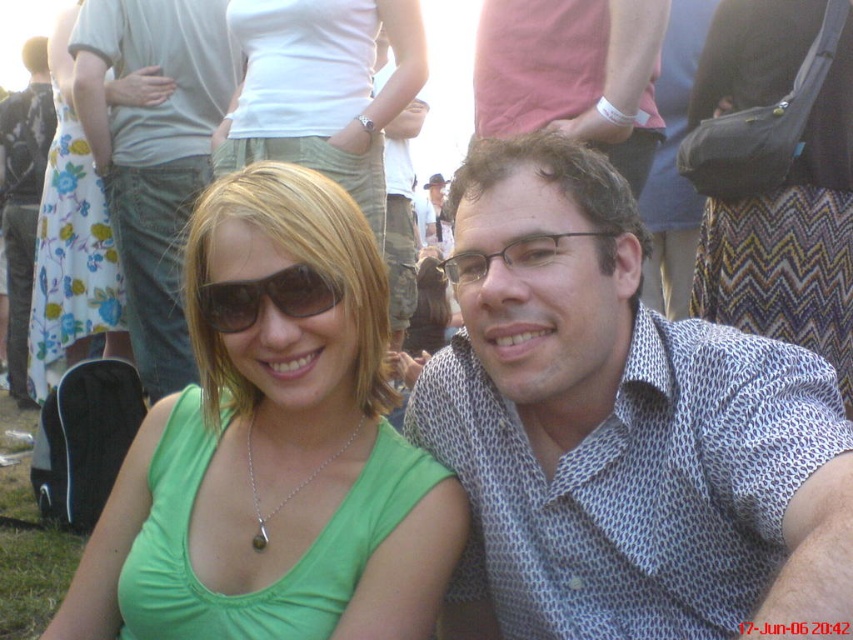
Looking at this image, you are a photographer at a busy event and need to adjust the lighting to ensure both the matte gray shirt at center and the matte pink shirt at upper center are visible. Which shirt should you focus on first to avoid shadows, considering their positions?

The matte gray shirt at center is positioned under the matte pink shirt at upper center, so focusing on the matte pink shirt at upper center first would help avoid shadows from it affecting the matte gray shirt below.